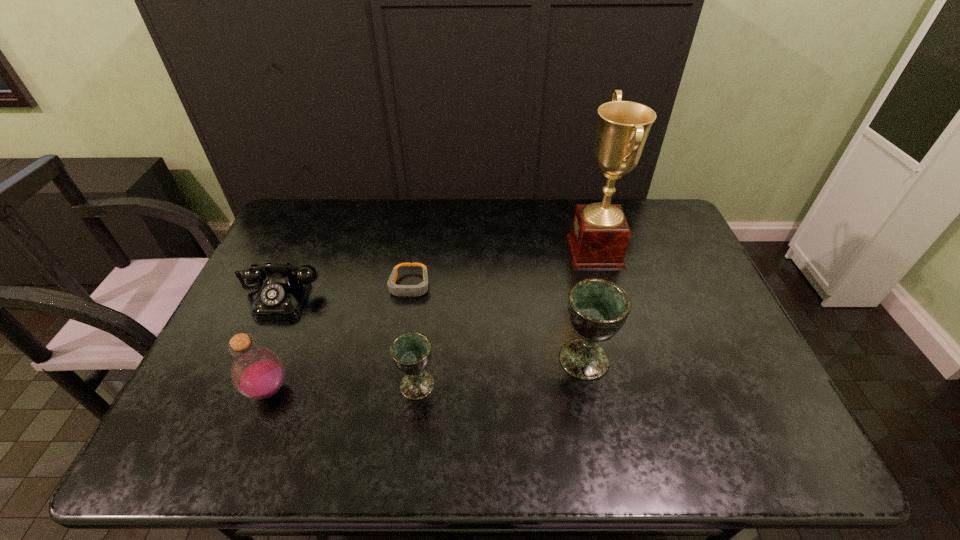
You are a GUI agent. You are given a task and a screenshot of the screen. Output one action in this format:
    pyautogui.click(x=<x>, y=<y>)
    Task: Click on the object at the near left corner
    This screenshot has width=960, height=540.
    Given the screenshot: What is the action you would take?
    pyautogui.click(x=257, y=373)

In the image, there is a desktop. Where is `blank space at the far edge`? Image resolution: width=960 pixels, height=540 pixels. blank space at the far edge is located at coordinates (447, 227).

You are a GUI agent. You are given a task and a screenshot of the screen. Output one action in this format:
    pyautogui.click(x=<x>, y=<y>)
    Task: Click on the vacant space at the near edge of the desktop
    Image resolution: width=960 pixels, height=540 pixels.
    Given the screenshot: What is the action you would take?
    pyautogui.click(x=303, y=385)

At what (x,y) coordinates should I click in order to perform the action: click on vacant space at the left edge of the desktop. Please return your answer as a coordinate pair (x, y). Looking at the image, I should click on (222, 366).

Locate an element on the screen. vacant area at the right edge of the desktop is located at coordinates (696, 346).

Image resolution: width=960 pixels, height=540 pixels. What are the coordinates of `vacant space at the far left corner` in the screenshot? It's located at (295, 204).

Locate an element on the screen. free spot at the far right corner of the desktop is located at coordinates click(x=636, y=201).

In order to click on free space between the taller chalice and the left chalice in this screenshot , I will do `click(500, 372)`.

Locate an element on the screen. vacant area that lies between the trophy cup and the second shortest object is located at coordinates (438, 274).

Locate an element on the screen. free space between the second shortest object and the goggles is located at coordinates (346, 291).